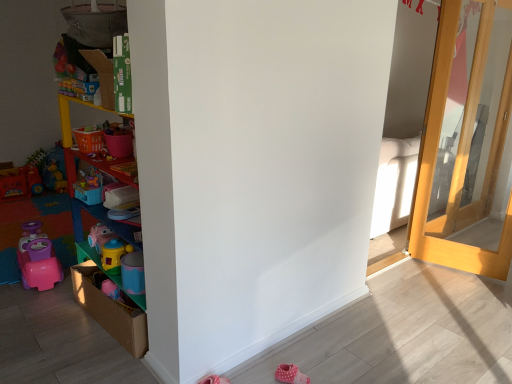
Question: Can you confirm if light wood door at right is shorter than multicolored plastic shelves at left?

Choices:
 (A) no
 (B) yes

Answer: (A)

Question: From the image's perspective, is light wood door at right on multicolored plastic shelves at left?

Choices:
 (A) yes
 (B) no

Answer: (A)

Question: Can you confirm if light wood door at right is wider than multicolored plastic shelves at left?

Choices:
 (A) no
 (B) yes

Answer: (A)

Question: Is there a large distance between light wood door at right and multicolored plastic shelves at left?

Choices:
 (A) no
 (B) yes

Answer: (B)

Question: Is light wood door at right in contact with multicolored plastic shelves at left?

Choices:
 (A) no
 (B) yes

Answer: (A)

Question: Is light wood door at right inside the boundaries of pink fabric shoe at lower right, or outside?

Choices:
 (A) outside
 (B) inside

Answer: (A)

Question: From the image's perspective, is light wood door at right positioned above or below pink fabric shoe at lower right?

Choices:
 (A) above
 (B) below

Answer: (A)

Question: Looking at their shapes, would you say light wood door at right is wider or thinner than pink fabric shoe at lower right?

Choices:
 (A) wide
 (B) thin

Answer: (B)

Question: From a real-world perspective, is light wood door at right above or below pink fabric shoe at lower right?

Choices:
 (A) above
 (B) below

Answer: (A)

Question: Considering the positions of pink fabric shoe at lower right and multicolored plastic shelves at left in the image, is pink fabric shoe at lower right bigger or smaller than multicolored plastic shelves at left?

Choices:
 (A) big
 (B) small

Answer: (B)

Question: In terms of width, does pink fabric shoe at lower right look wider or thinner when compared to multicolored plastic shelves at left?

Choices:
 (A) thin
 (B) wide

Answer: (B)

Question: From their relative heights in the image, would you say pink fabric shoe at lower right is taller or shorter than multicolored plastic shelves at left?

Choices:
 (A) short
 (B) tall

Answer: (A)

Question: From a real-world perspective, is pink fabric shoe at lower right physically located above or below multicolored plastic shelves at left?

Choices:
 (A) below
 (B) above

Answer: (A)

Question: From a real-world perspective, relative to pink fabric shoe at lower right, is multicolored plastic shelves at left vertically above or below?

Choices:
 (A) below
 (B) above

Answer: (B)

Question: Is multicolored plastic shelves at left to the left or to the right of pink fabric shoe at lower right in the image?

Choices:
 (A) right
 (B) left

Answer: (B)